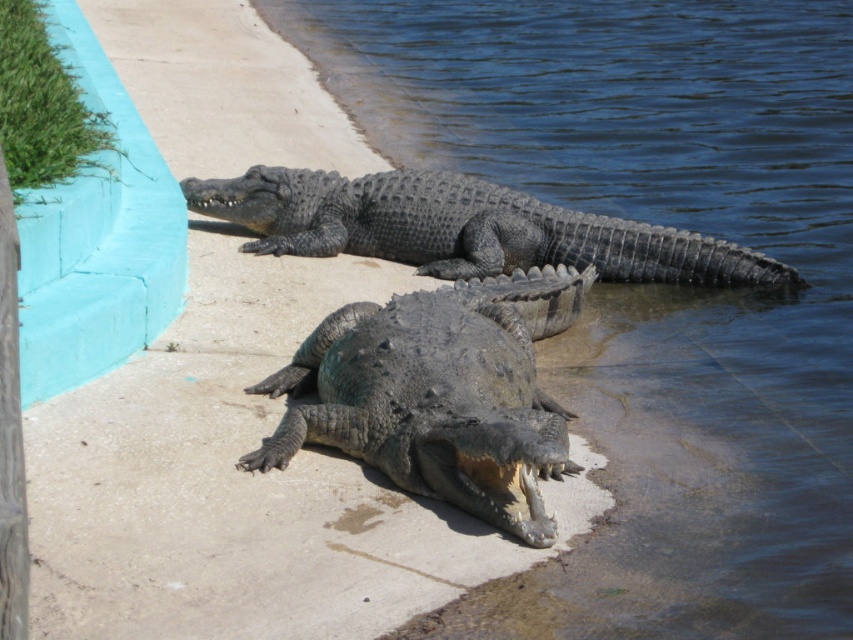
Question: In this image, where is shiny dark green crocodile at center located relative to shiny dark gray crocodile at upper center?

Choices:
 (A) right
 (B) left

Answer: (B)

Question: Which of the following is the farthest from the observer?

Choices:
 (A) (654, 250)
 (B) (294, 24)
 (C) (560, 408)

Answer: (B)

Question: Does clear blue water at center have a larger size compared to shiny dark gray crocodile at upper center?

Choices:
 (A) no
 (B) yes

Answer: (B)

Question: Is shiny dark green crocodile at center thinner than shiny dark gray crocodile at upper center?

Choices:
 (A) no
 (B) yes

Answer: (B)

Question: Which point appears closest to the camera in this image?

Choices:
 (A) (674, 108)
 (B) (292, 170)

Answer: (B)

Question: Which of the following is the farthest from the observer?

Choices:
 (A) clear blue water at center
 (B) shiny dark gray crocodile at upper center

Answer: (B)